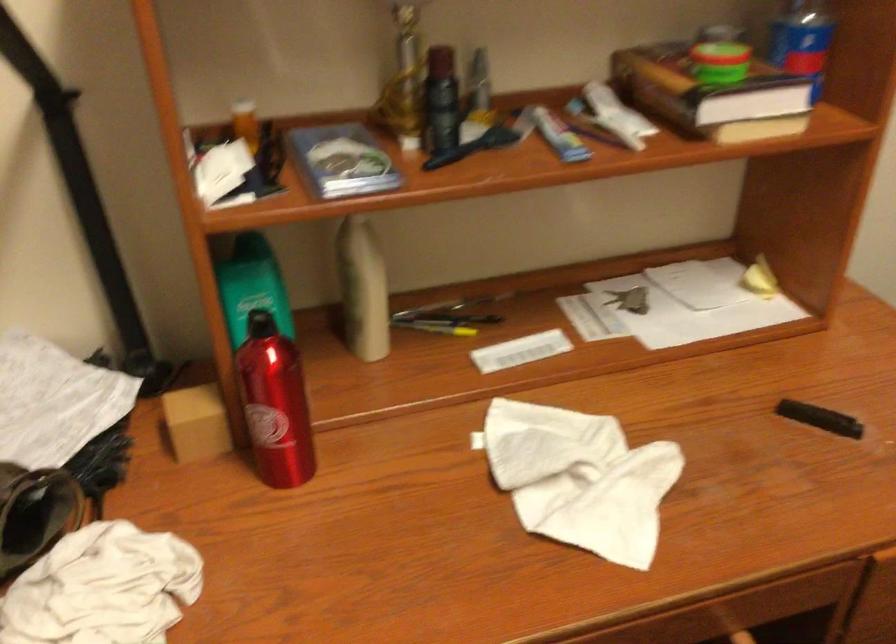
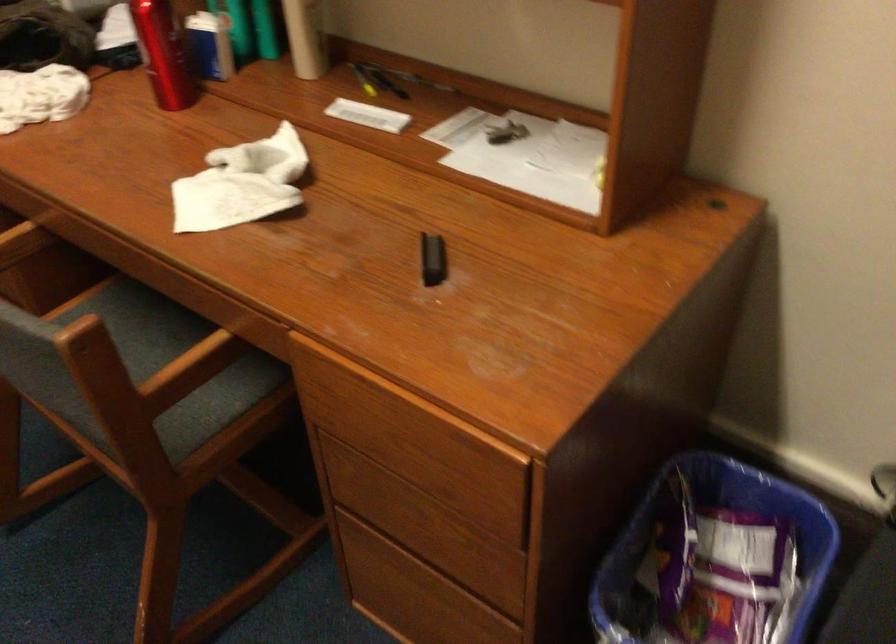
In the second image, find the point that corresponds to point (624, 301) in the first image.

(504, 131)